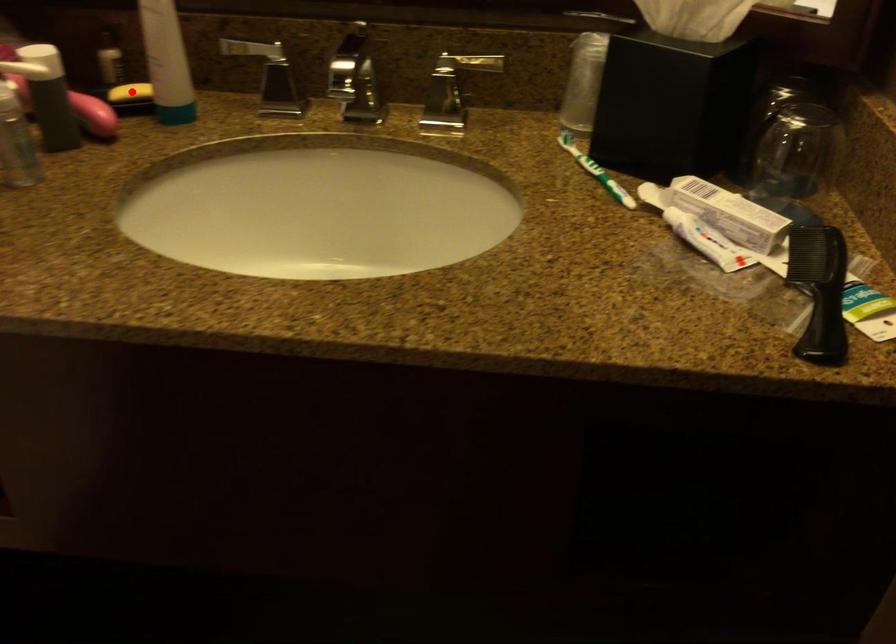
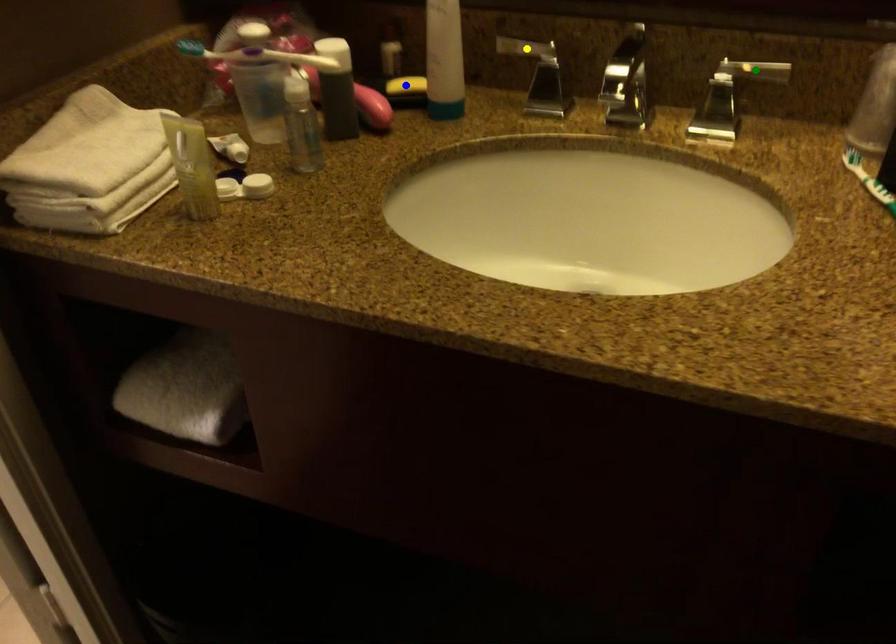
Question: I am providing you with two images of the same scene from different viewpoints. A red point is marked on the first image. You are given multiple points on the second image. Can you choose the point in image 2 that corresponds to the point in image 1?

Choices:
 (A) green point
 (B) yellow point
 (C) blue point

Answer: (C)